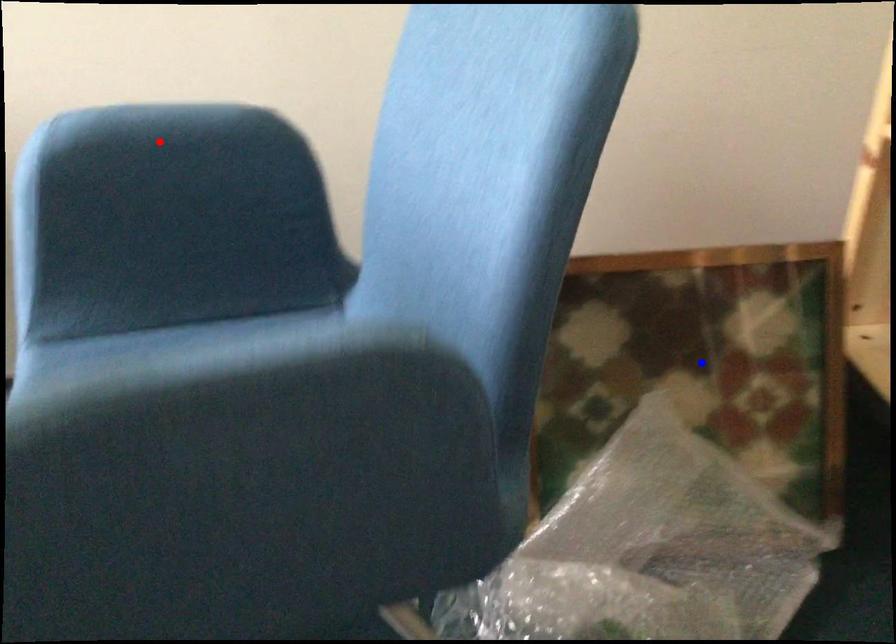
Question: Which of the two points in the image is closer to the camera?

Choices:
 (A) Blue point is closer.
 (B) Red point is closer.

Answer: (B)